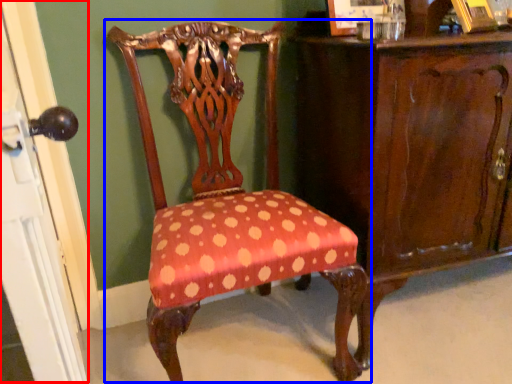
Question: Which object is further to the camera taking this photo, screen door (highlighted by a red box) or chair (highlighted by a blue box)?

Choices:
 (A) screen door
 (B) chair

Answer: (B)